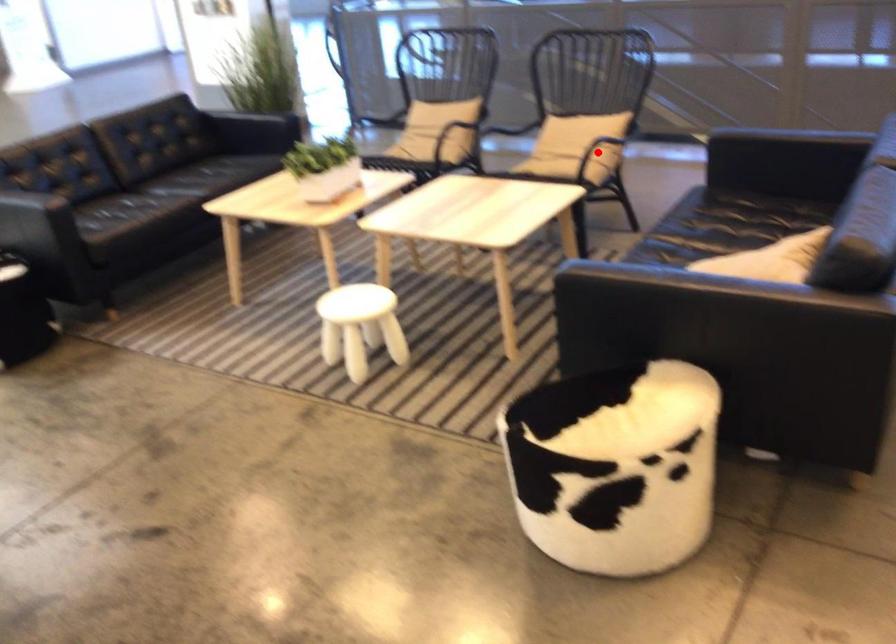
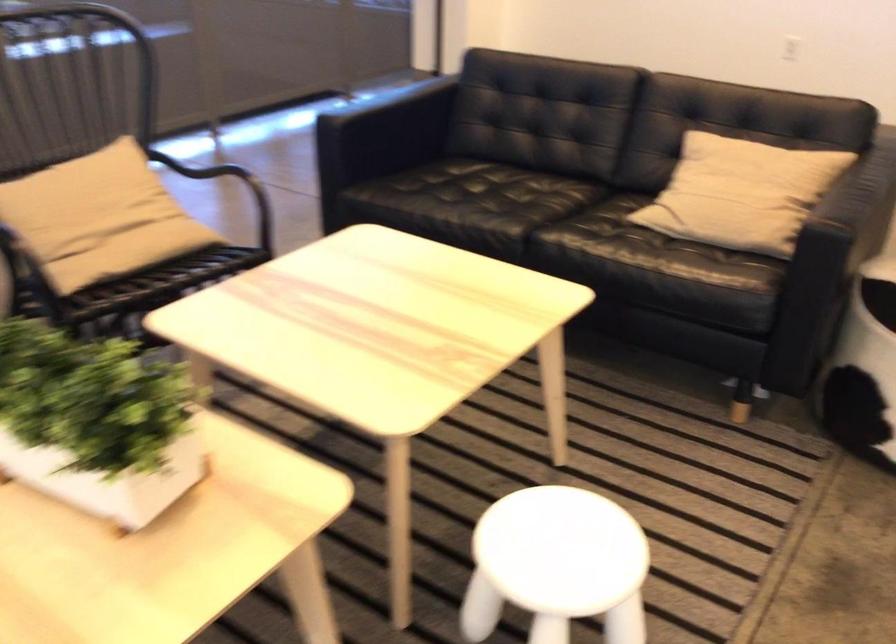
Question: I am providing you with two images of the same scene from different viewpoints. A red point is marked on the first image. At the location where the point appears in image 1, is it still visible in image 2?

Choices:
 (A) Yes
 (B) No

Answer: (B)